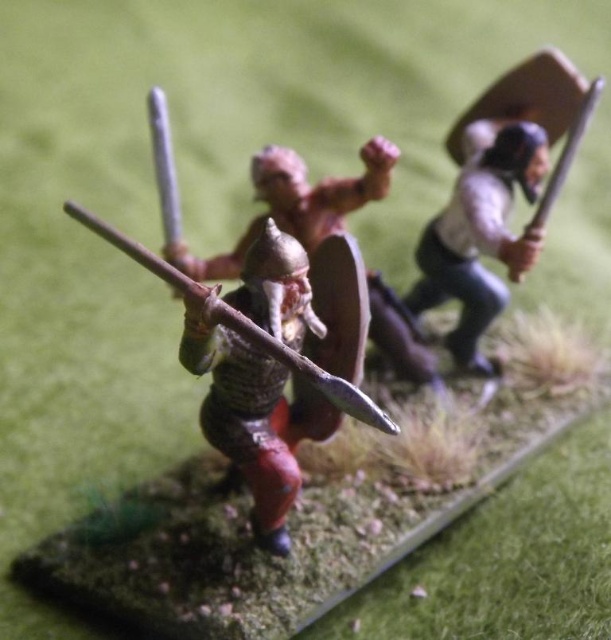
Question: Which object appears farthest from the camera in this image?

Choices:
 (A) metallic armor at center
 (B) white matte shield at upper right

Answer: (B)

Question: Does metallic armor at center appear on the left side of metallic spear at center?

Choices:
 (A) yes
 (B) no

Answer: (A)

Question: Which object appears closest to the camera in this image?

Choices:
 (A) metallic armor at center
 (B) white matte shield at upper right
 (C) metallic spear at center

Answer: (C)

Question: Is the position of metallic armor at center more distant than that of white matte shield at upper right?

Choices:
 (A) no
 (B) yes

Answer: (A)

Question: Which object is positioned farthest from the metallic spear at center?

Choices:
 (A) white matte shield at upper right
 (B) metallic armor at center

Answer: (A)

Question: Where is metallic armor at center located in relation to wooden shield at upper right in the image?

Choices:
 (A) below
 (B) above

Answer: (A)